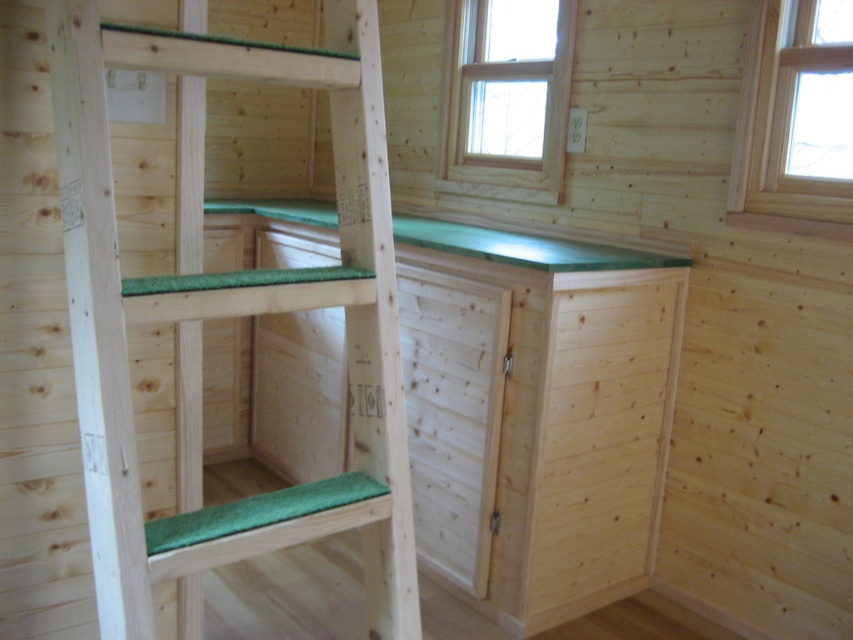
Consider the image. Can you confirm if green matte wood ladder at center is positioned to the right of clear glass window at upper center?

Incorrect, green matte wood ladder at center is not on the right side of clear glass window at upper center.

Who is shorter, green matte wood ladder at center or clear glass window at upper center?

clear glass window at upper center is shorter.

Find the location of `green matte wood ladder at center`. green matte wood ladder at center is located at coordinates point(228,316).

Identify the location of green matte wood ladder at center. (228, 316).

Does point (546, 54) come farther from viewer compared to point (808, 168)?

No.

Does point (494, 92) come closer to viewer compared to point (838, 115)?

Yes, it is in front of point (838, 115).

What are the coordinates of `clear glass window at upper center` in the screenshot? It's located at (505, 97).

Who is lower down, green matte wood ladder at center or clear glass window at upper right?

green matte wood ladder at center is below.

Does green matte wood ladder at center have a greater height compared to clear glass window at upper right?

In fact, green matte wood ladder at center may be shorter than clear glass window at upper right.

Where is `green matte wood ladder at center`? green matte wood ladder at center is located at coordinates (228, 316).

Find the location of `green matte wood ladder at center`. green matte wood ladder at center is located at coordinates (228, 316).